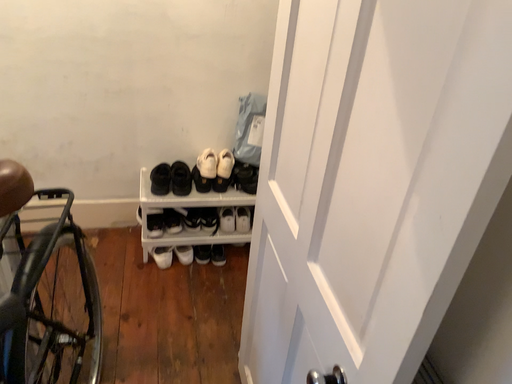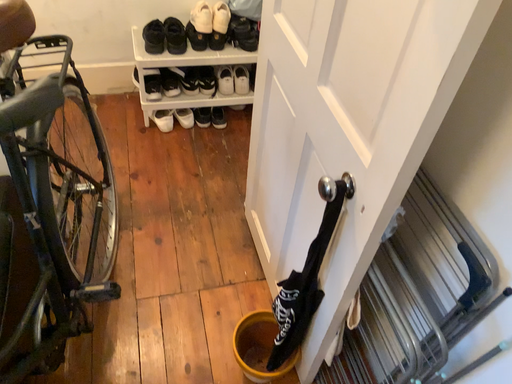
Question: How did the camera likely rotate when shooting the video?

Choices:
 (A) rotated upward
 (B) rotated downward

Answer: (B)